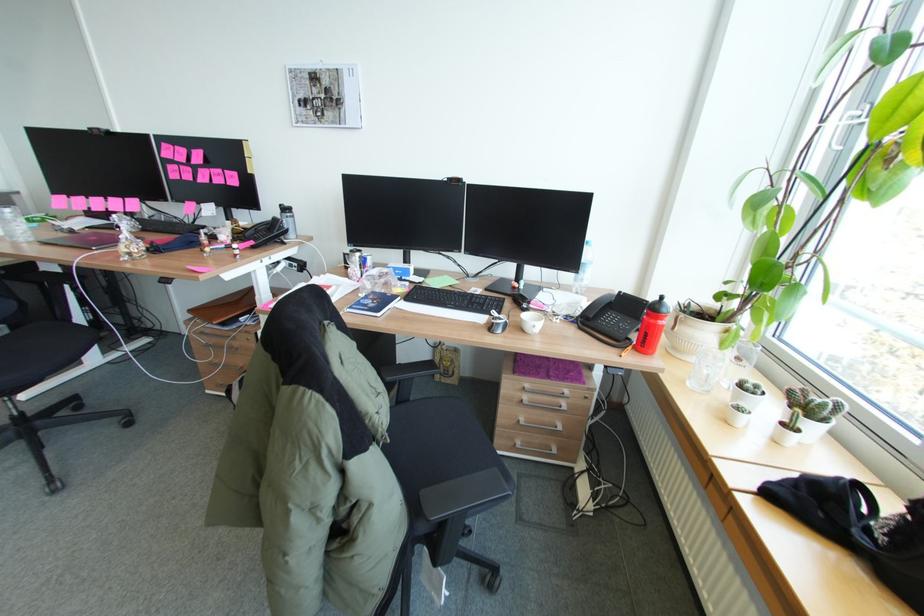
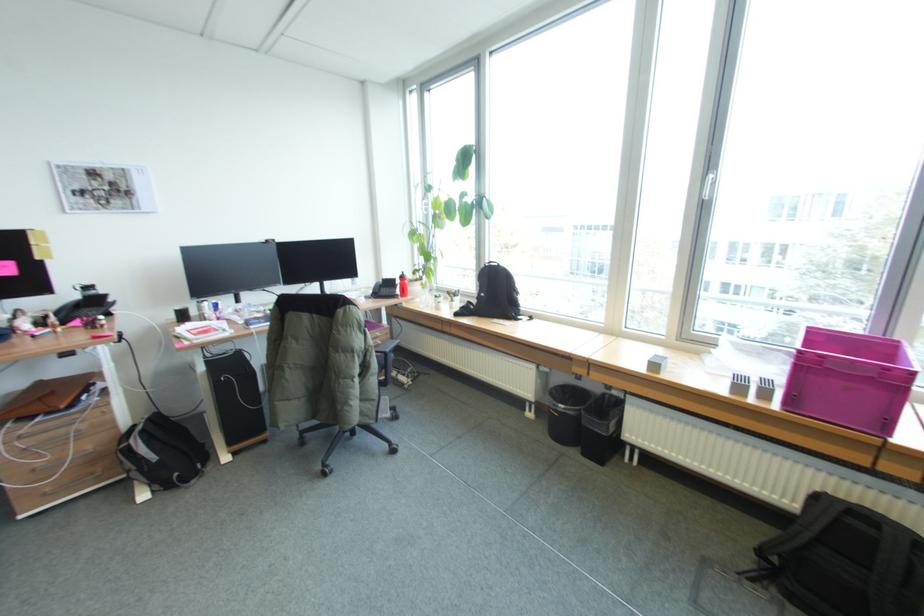
The point at (639, 337) is marked in the first image. Where is the corresponding point in the second image?

(403, 292)